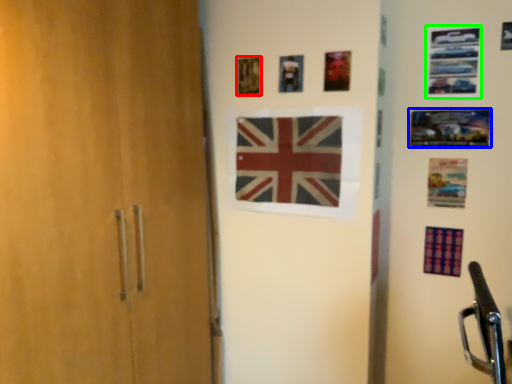
Question: Which is farther away from picture frame (highlighted by a red box)? picture frame (highlighted by a blue box) or picture frame (highlighted by a green box)?

Choices:
 (A) picture frame
 (B) picture frame

Answer: (A)